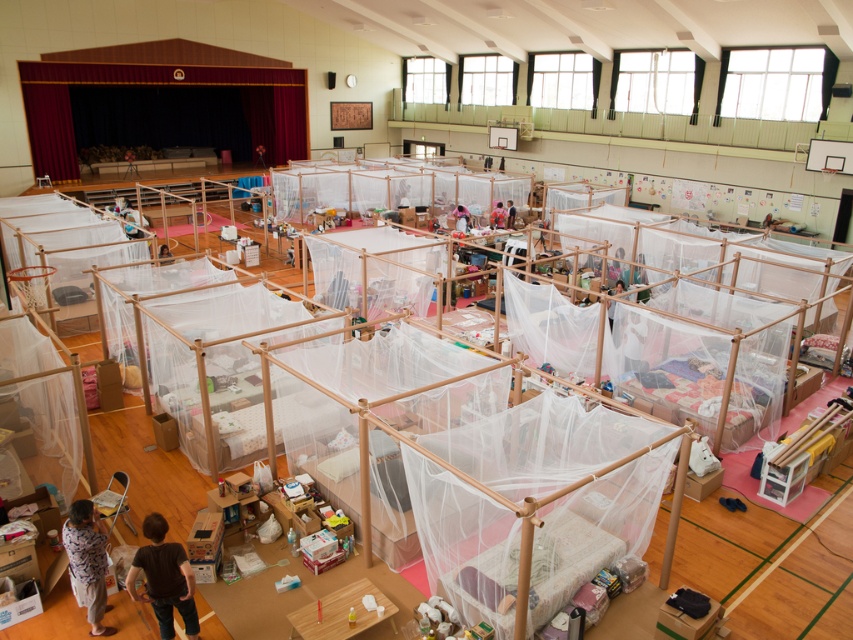
Which is behind, point (473, 200) or point (93, 525)?

Point (473, 200)

Does white mesh canopy bed at center have a lesser width compared to light blue fabric shirt at lower left?

Incorrect, white mesh canopy bed at center's width is not less than light blue fabric shirt at lower left's.

Which is behind, point (502, 180) or point (90, 566)?

The point (502, 180) is behind.

Where is `white mesh canopy bed at center`? This screenshot has width=853, height=640. white mesh canopy bed at center is located at coordinates (387, 188).

Is brown fabric child at lower left to the left of light blue fabric shirt at lower left from the viewer's perspective?

Incorrect, brown fabric child at lower left is not on the left side of light blue fabric shirt at lower left.

Does point (181, 589) lie in front of point (84, 560)?

Yes.

What do you see at coordinates (164, 579) in the screenshot? I see `brown fabric child at lower left` at bounding box center [164, 579].

Locate an element on the screen. This screenshot has height=640, width=853. brown fabric child at lower left is located at coordinates (164, 579).

This screenshot has height=640, width=853. What do you see at coordinates (387, 188) in the screenshot?
I see `white mesh canopy bed at center` at bounding box center [387, 188].

Which is more to the right, white mesh canopy bed at center or brown fabric child at lower left?

Positioned to the right is white mesh canopy bed at center.

I want to click on white mesh canopy bed at center, so click(x=387, y=188).